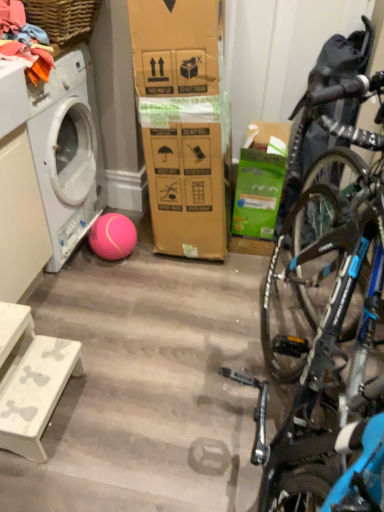
Question: Considering the positions of woven wood picnic basket at upper left and soft cotton clothes at upper left in the image, is woven wood picnic basket at upper left taller or shorter than soft cotton clothes at upper left?

Choices:
 (A) short
 (B) tall

Answer: (A)

Question: Looking at their shapes, would you say woven wood picnic basket at upper left is wider or thinner than soft cotton clothes at upper left?

Choices:
 (A) thin
 (B) wide

Answer: (B)

Question: Estimate the real-world distances between objects in this image. Which object is closer to the green cardboard box at center-right?

Choices:
 (A) woven wood picnic basket at upper left
 (B) soft cotton clothes at upper left
 (C) white marble step stool at lower left
 (D) white matte washing machine at left

Answer: (D)

Question: Based on their relative distances, which object is nearer to the white matte washing machine at left?

Choices:
 (A) green cardboard box at center-right
 (B) white marble step stool at lower left
 (C) soft cotton clothes at upper left
 (D) woven wood picnic basket at upper left

Answer: (C)